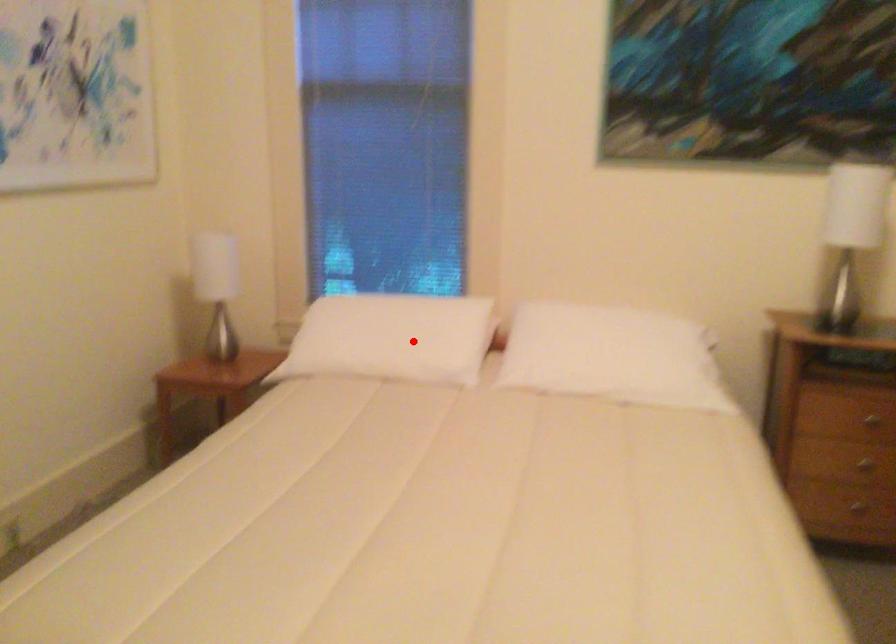
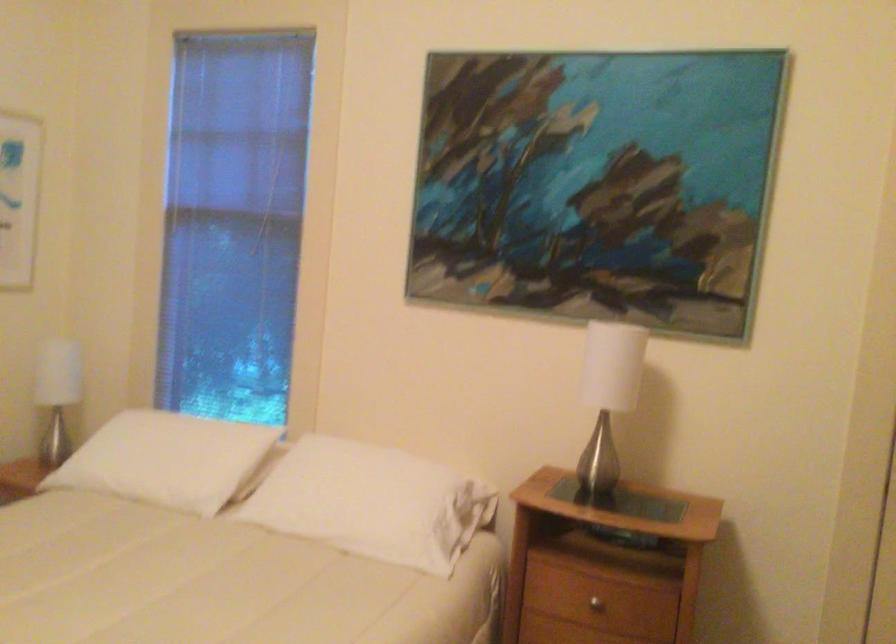
Locate, in the second image, the point that corresponds to the highlighted location in the first image.

(167, 459)